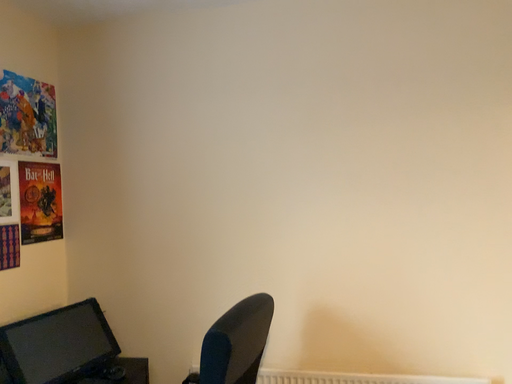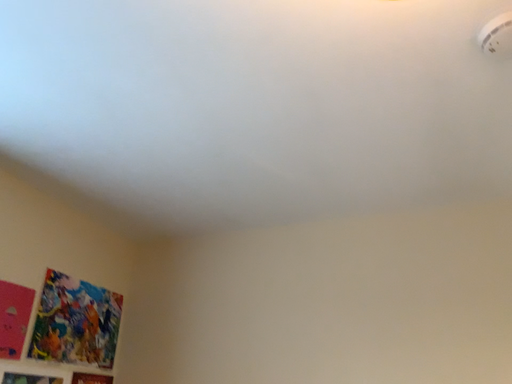
Question: Which way did the camera rotate in the video?

Choices:
 (A) rotated downward
 (B) rotated upward

Answer: (B)